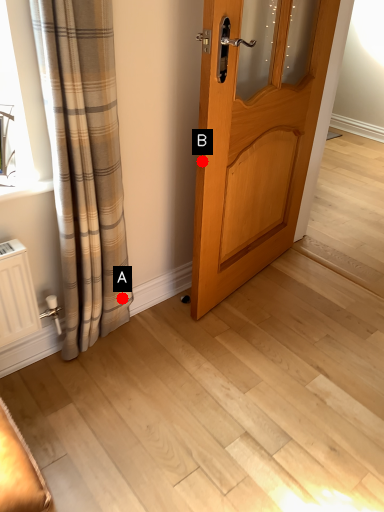
Question: Two points are circled on the image, labeled by A and B beside each circle. Which point is farther to the camera?

Choices:
 (A) A is further
 (B) B is further

Answer: (A)